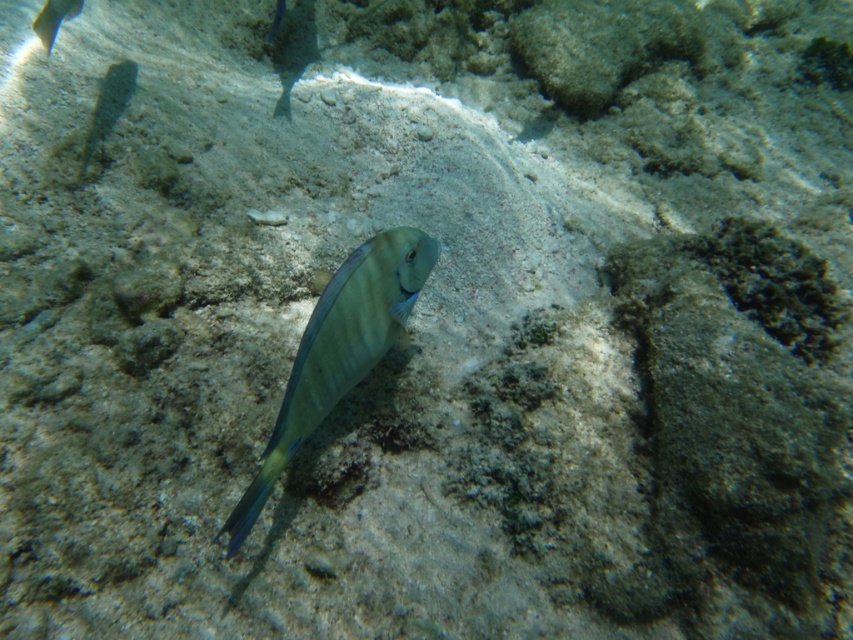
Looking at this image, between shiny blue fish at center and shiny blue fish at upper left, which one appears on the left side from the viewer's perspective?

Positioned to the left is shiny blue fish at upper left.

Can you confirm if shiny blue fish at center is thinner than shiny blue fish at upper left?

No, shiny blue fish at center is not thinner than shiny blue fish at upper left.

The height and width of the screenshot is (640, 853). Describe the element at coordinates (339, 349) in the screenshot. I see `shiny blue fish at center` at that location.

This screenshot has width=853, height=640. I want to click on shiny blue fish at center, so click(339, 349).